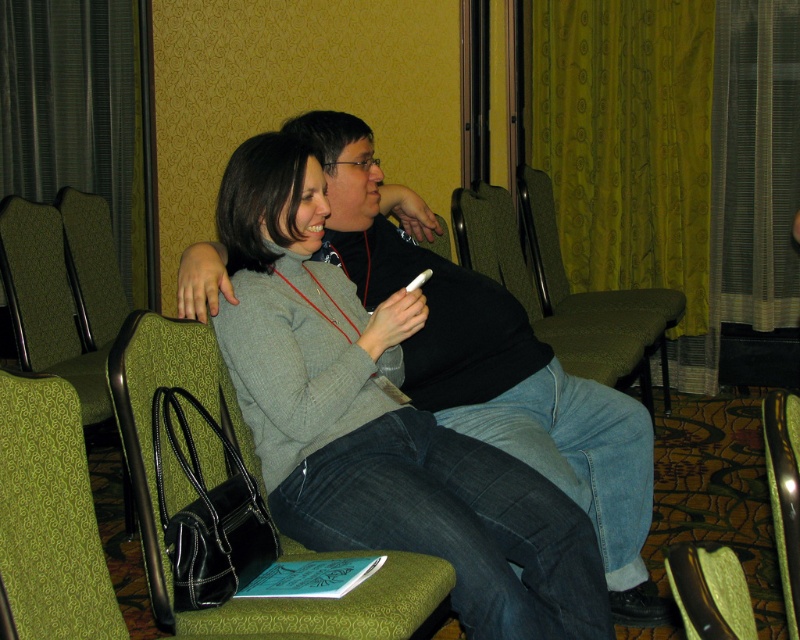
Question: Where is green fabric armchair at lower left located in relation to green fabric armchair at lower right in the image?

Choices:
 (A) right
 (B) left

Answer: (B)

Question: Is green fabric armchair at lower left to the right of green fabric armchair at left from the viewer's perspective?

Choices:
 (A) yes
 (B) no

Answer: (A)

Question: From the image, what is the correct spatial relationship of matte gray sweater at center in relation to green fabric armchair at lower left?

Choices:
 (A) below
 (B) above

Answer: (B)

Question: Which object is positioned farthest from the green fabric armchair at left?

Choices:
 (A) matte gray sweater at center
 (B) green fabric chair at center

Answer: (B)

Question: Which point is farther from the camera taking this photo?

Choices:
 (A) (218, 378)
 (B) (788, 586)

Answer: (A)

Question: Which point is closer to the camera taking this photo?

Choices:
 (A) (721, 625)
 (B) (490, 448)
 (C) (73, 467)

Answer: (A)